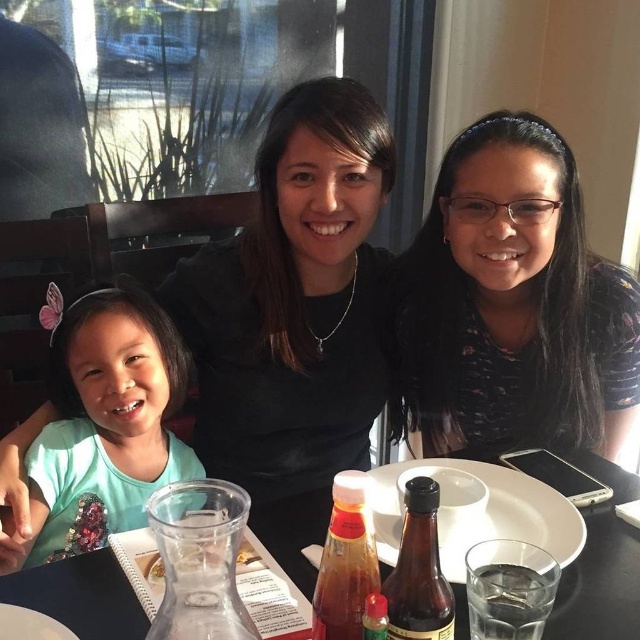
Question: Among these points, which one is nearest to the camera?

Choices:
 (A) (612, 477)
 (B) (538, 260)
 (C) (49, 538)

Answer: (A)

Question: Can you confirm if black matte shirt at center is positioned to the left of clear glass carafe at lower left?

Choices:
 (A) no
 (B) yes

Answer: (B)

Question: Which of these objects is positioned farthest from the clear glass carafe at lower left?

Choices:
 (A) black matte shirt at center
 (B) green matte shirt at left
 (C) black matte shirt at upper center

Answer: (B)

Question: Can you confirm if black matte shirt at center is positioned to the right of green matte shirt at left?

Choices:
 (A) yes
 (B) no

Answer: (A)

Question: Which point is closer to the camera?

Choices:
 (A) (388, 189)
 (B) (625, 545)
 (C) (600, 426)
 (D) (160, 328)

Answer: (B)

Question: Is black matte shirt at upper center thinner than clear glass carafe at lower left?

Choices:
 (A) yes
 (B) no

Answer: (B)